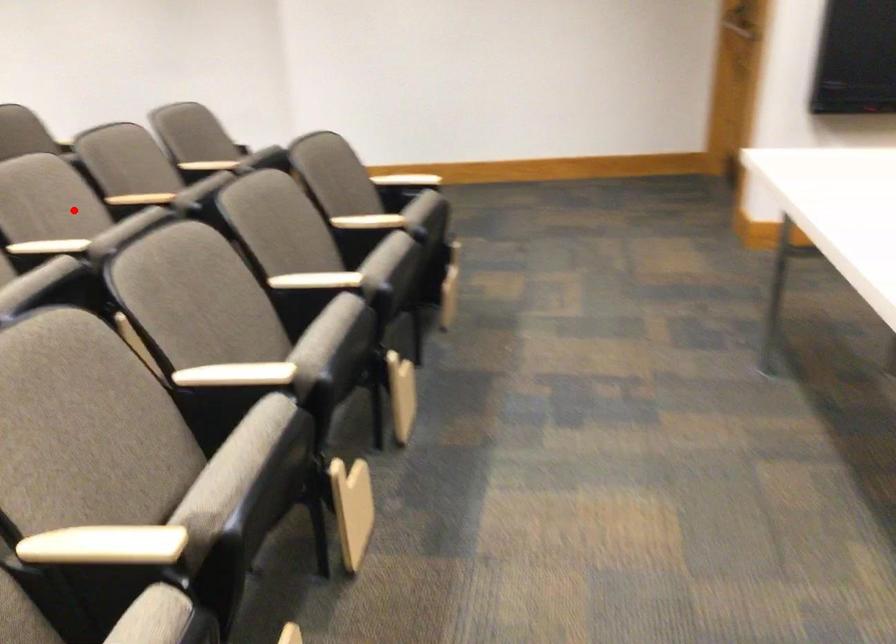
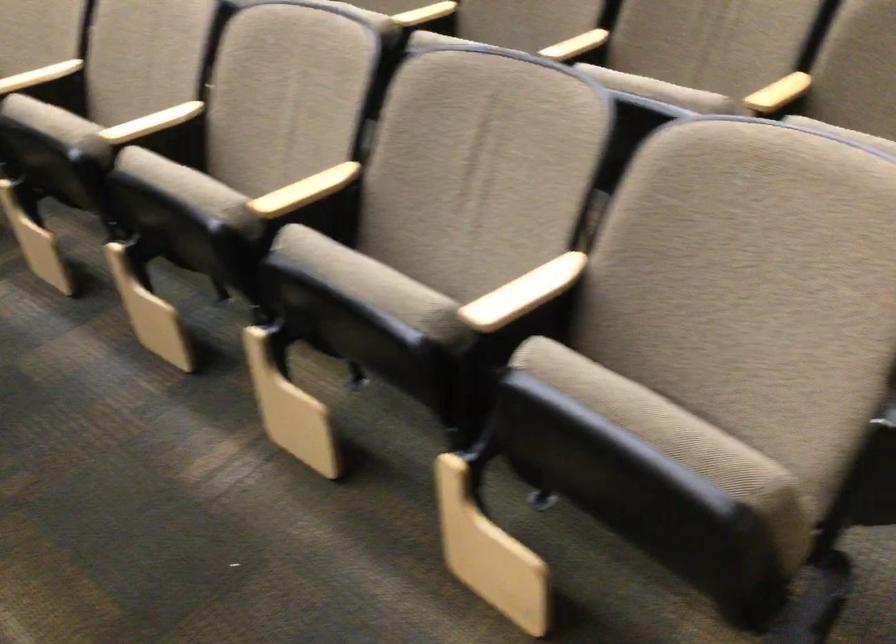
In the second image, find the point that corresponds to the highlighted location in the first image.

(151, 122)